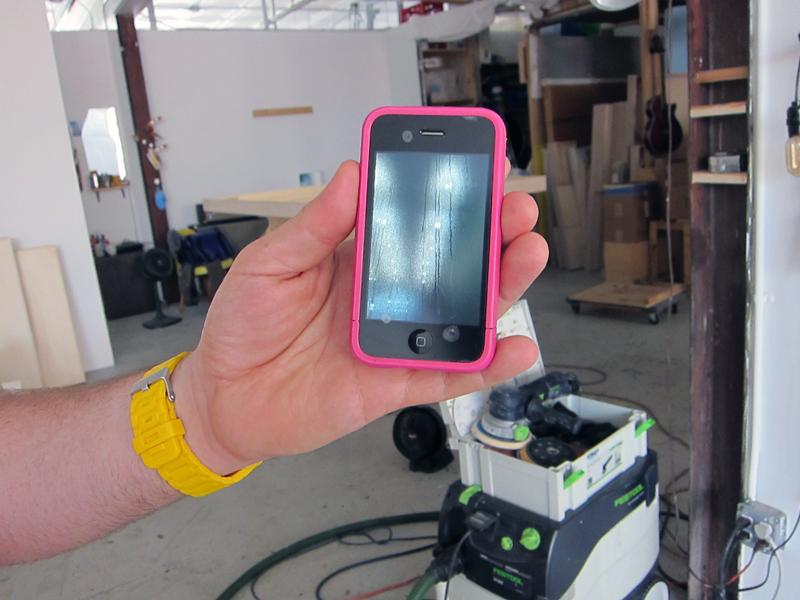
Find the location of a particular element. white pony wall is located at coordinates (194, 98).